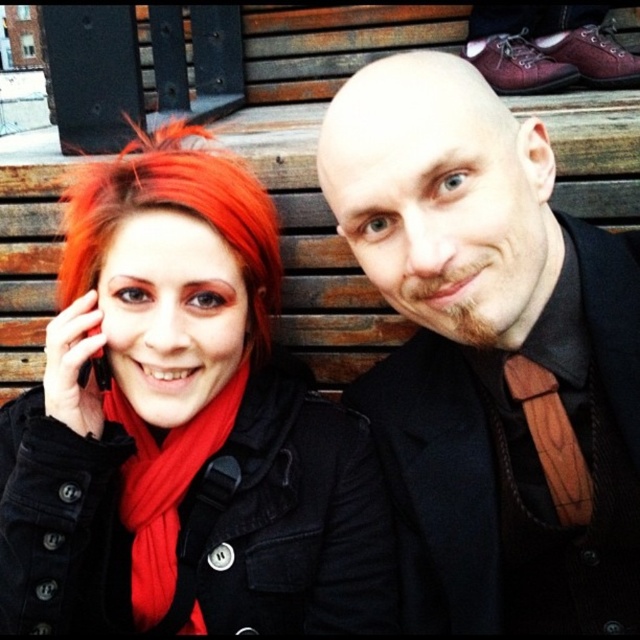
Question: Among these points, which one is farthest from the camera?

Choices:
 (A) (212, 157)
 (B) (417, 161)
 (C) (108, 202)

Answer: (A)

Question: Which point is closer to the camera?

Choices:
 (A) red soft scarf at left
 (B) matte black coat at left

Answer: (B)

Question: Does matte black jacket at center have a smaller size compared to red soft scarf at left?

Choices:
 (A) yes
 (B) no

Answer: (B)

Question: Which object appears farthest from the camera in this image?

Choices:
 (A) matte black coat at left
 (B) matte black jacket at center
 (C) red soft scarf at left

Answer: (C)

Question: Does matte black jacket at center appear on the left side of matte black coat at left?

Choices:
 (A) yes
 (B) no

Answer: (B)

Question: Is matte black jacket at center positioned before shiny red hair at left?

Choices:
 (A) no
 (B) yes

Answer: (B)